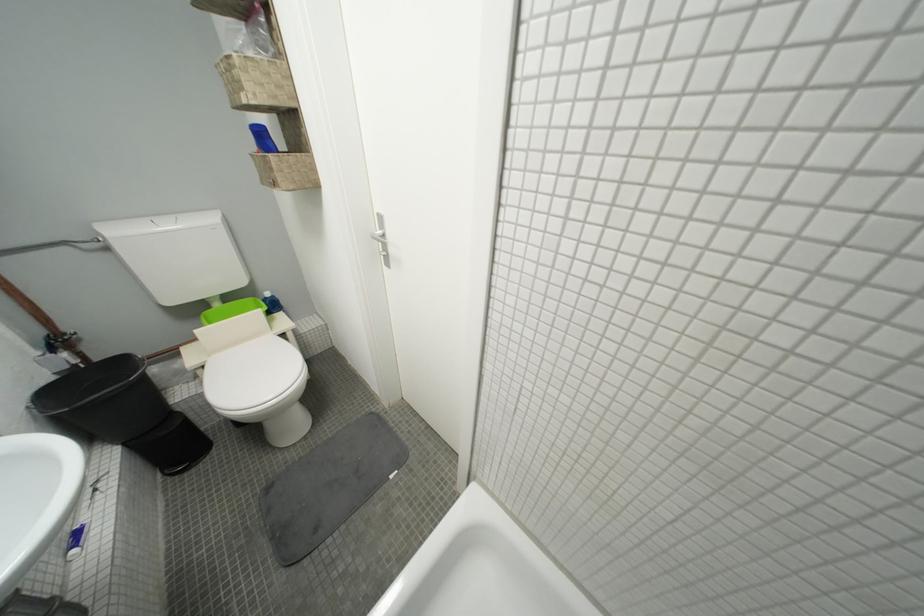
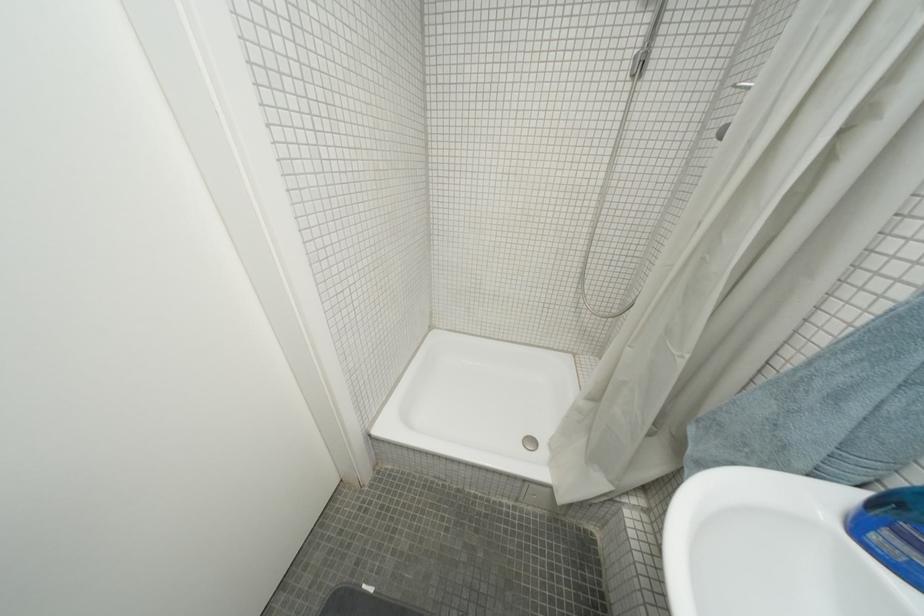
The first image is from the beginning of the video and the second image is from the end. How did the camera likely rotate when shooting the video?

The camera's rotation is toward right-down.